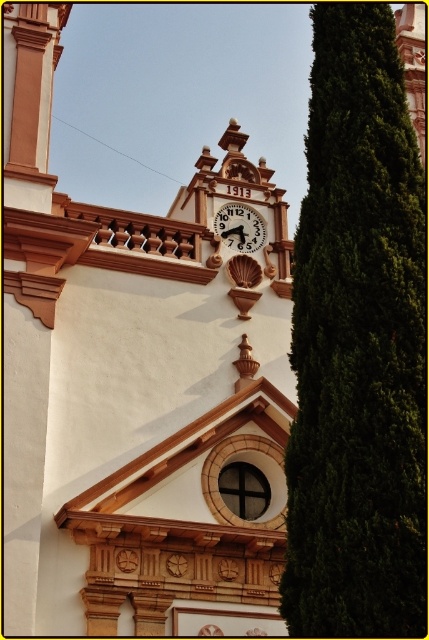
Question: Which of the following is the closest to the observer?

Choices:
 (A) wooden clock at center
 (B) green leafy tree at right

Answer: (B)

Question: Can you confirm if white stone clock at upper center is positioned to the left of green leafy tree at right?

Choices:
 (A) no
 (B) yes

Answer: (B)

Question: Which point is farther to the camera?

Choices:
 (A) (353, 376)
 (B) (238, 380)
 (C) (220, 211)

Answer: (C)

Question: From the image, what is the correct spatial relationship of white stone clock at upper center in relation to green leafy tree at right?

Choices:
 (A) left
 (B) right

Answer: (A)

Question: From the image, what is the correct spatial relationship of white stone clock at upper center in relation to wooden clock at center?

Choices:
 (A) below
 (B) above

Answer: (A)

Question: Among these objects, which one is nearest to the camera?

Choices:
 (A) white stone clock at upper center
 (B) wooden clock at center
 (C) green leafy tree at right

Answer: (C)